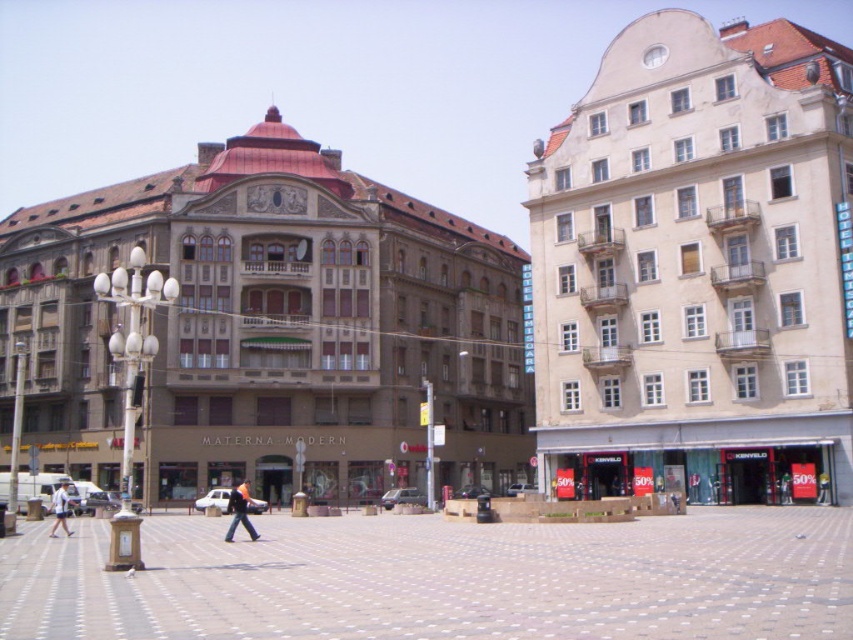
You are a fashion designer observing a busy urban square. You notice two clothing items hanging on a rack between the two buildings. The denim pants at center and the white cotton shirt at center. Which clothing item is positioned lower on the rack?

The denim pants at center is located below the white cotton shirt at center, so the denim pants at center is positioned lower on the rack.

You are standing in the urban square and want to walk towards the building on the left. Which point, point (247, 497) or point (51, 496), is closer to the building on the left?

Point (247, 497) is closer to the building on the left because it is in front of point (51, 496), which is further away from the building on the left.